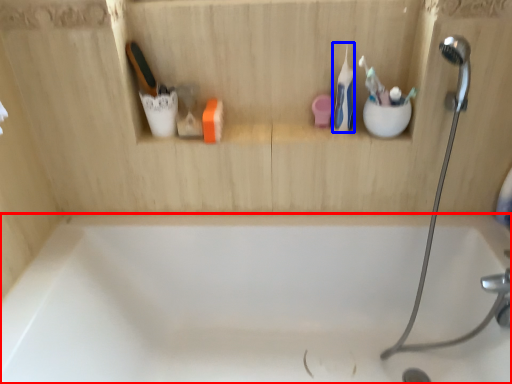
Question: Among these objects, which one is farthest to the camera, bathtub (highlighted by a red box) or toothbrush (highlighted by a blue box)?

Choices:
 (A) bathtub
 (B) toothbrush

Answer: (B)